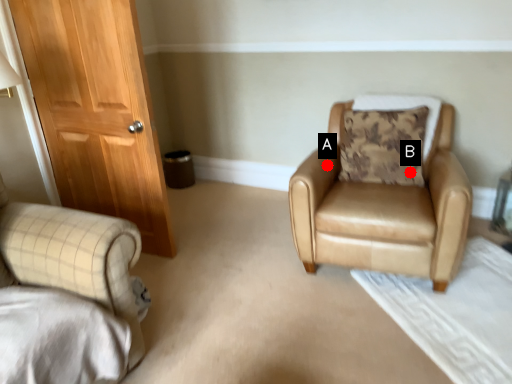
Question: Two points are circled on the image, labeled by A and B beside each circle. Among these points, which one is nearest to the camera?

Choices:
 (A) A is closer
 (B) B is closer

Answer: (A)